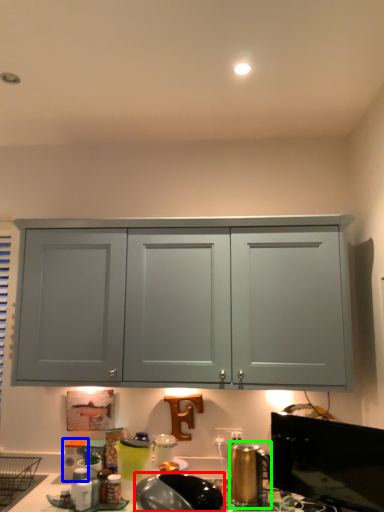
Question: Considering the real-world distances, which object is closest to appliance (highlighted by a red box)? appliance (highlighted by a blue box) or appliance (highlighted by a green box).

Choices:
 (A) appliance
 (B) appliance

Answer: (B)